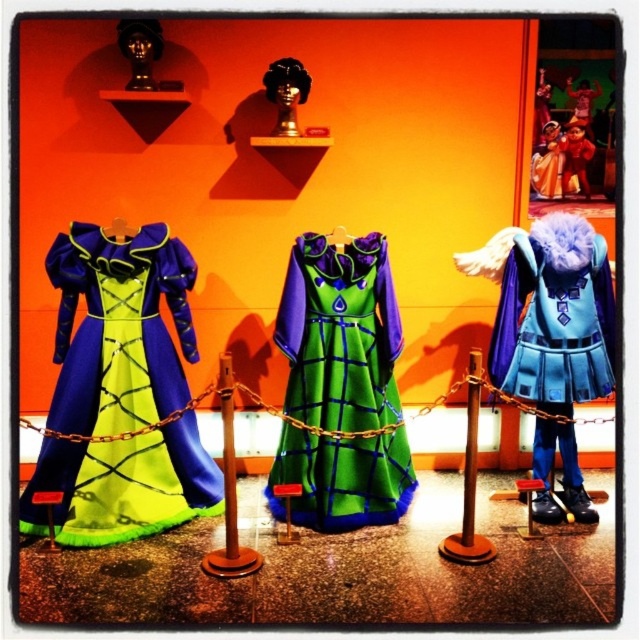
Which of these two, blue felt cape at right or brown wooden pole at center, stands taller?

blue felt cape at right

Which is behind, point (568, 276) or point (472, 392)?

The point (568, 276) is more distant.

Does point (600, 308) come closer to viewer compared to point (467, 412)?

No, it is behind (467, 412).

Where is `blue felt cape at right`? blue felt cape at right is located at coordinates 554,316.

Between matte purple and green gown at center and green velvet dress at center, which one has less height?

Standing shorter between the two is green velvet dress at center.

Between point (129, 253) and point (392, 324), which one is positioned behind?

Point (392, 324)

Who is more distant from viewer, (218, 500) or (285, 413)?

The point (285, 413) is more distant.

What are the coordinates of `matte purple and green gown at center` in the screenshot? It's located at (120, 328).

Is green velvet dress at center to the left of velvet red cape at center from the viewer's perspective?

Indeed, green velvet dress at center is positioned on the left side of velvet red cape at center.

Does green velvet dress at center have a lesser width compared to velvet red cape at center?

No.

Is point (312, 253) positioned after point (579, 182)?

No, (312, 253) is in front of (579, 182).

Locate an element on the screen. green velvet dress at center is located at coordinates (339, 333).